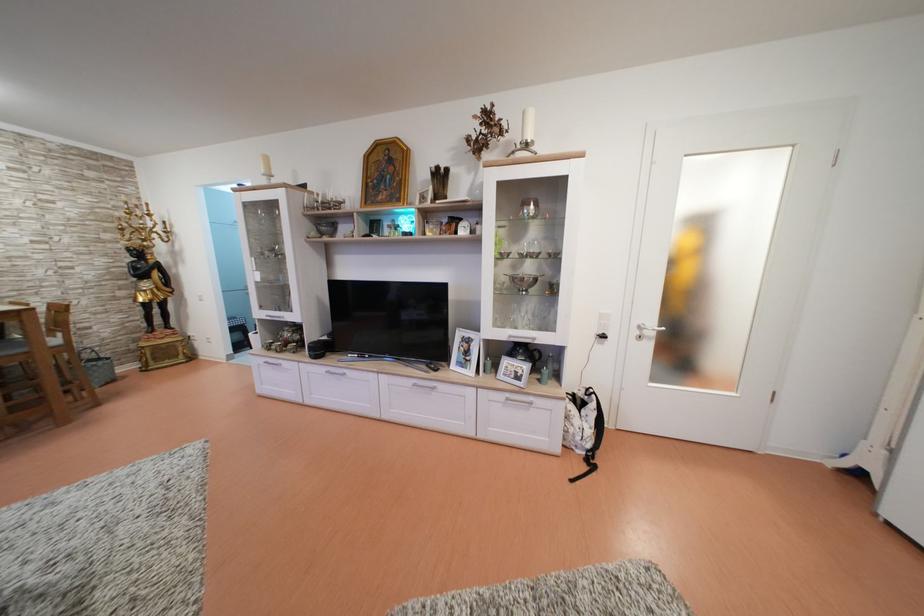
You are a GUI agent. You are given a task and a screenshot of the screen. Output one action in this format:
    pyautogui.click(x=<x>, y=<y>)
    Task: Click on the black telephone receiver
    This screenshot has height=616, width=924.
    Given the screenshot: What is the action you would take?
    pyautogui.click(x=524, y=353)